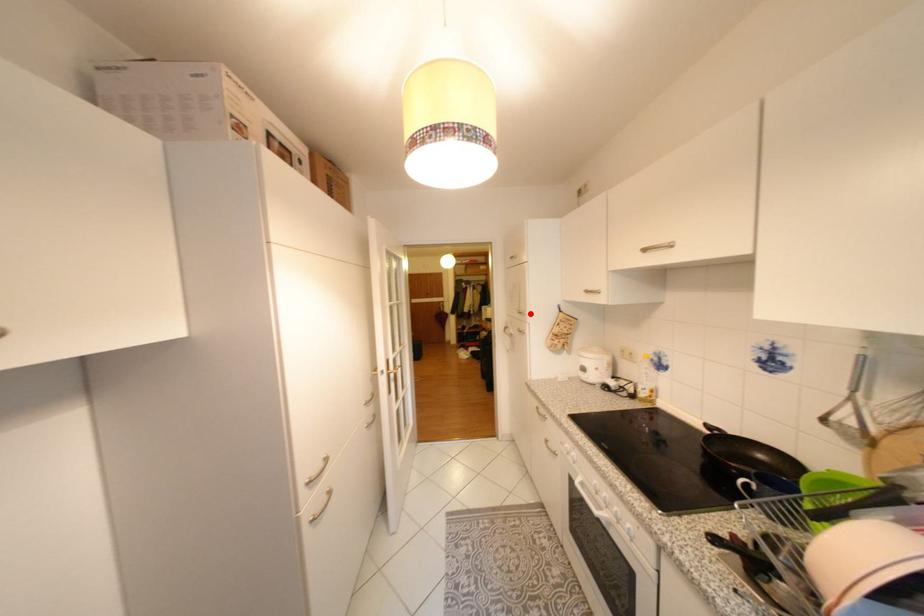
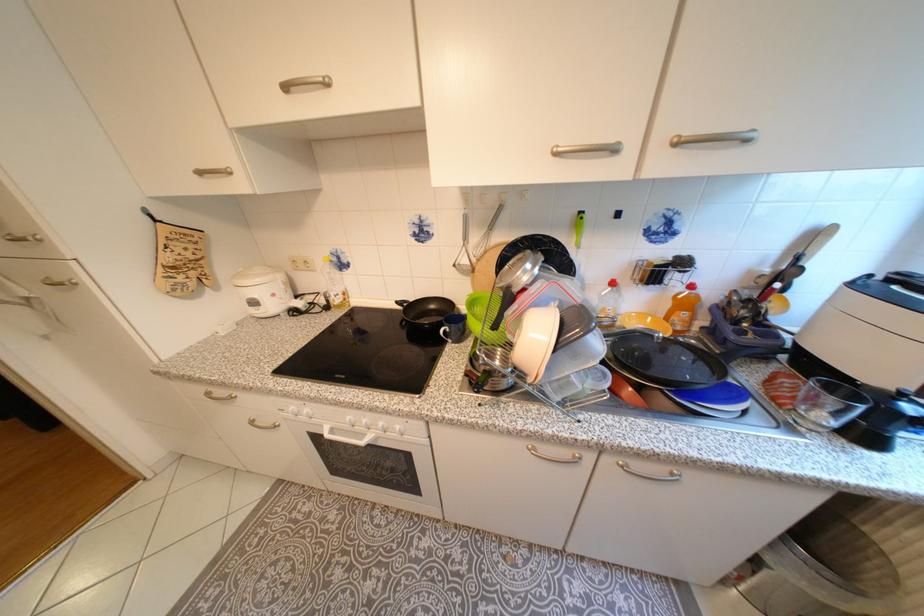
The point at the highlighted location is marked in the first image. Where is the corresponding point in the second image?

(31, 240)